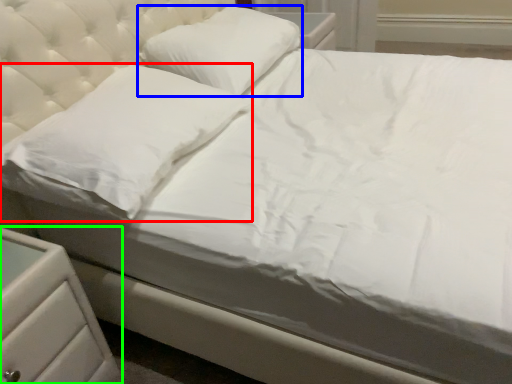
Question: Which object is the farthest from pillow (highlighted by a red box)? Choose among these: pillow (highlighted by a blue box) or nightstand (highlighted by a green box).

Choices:
 (A) pillow
 (B) nightstand

Answer: (A)